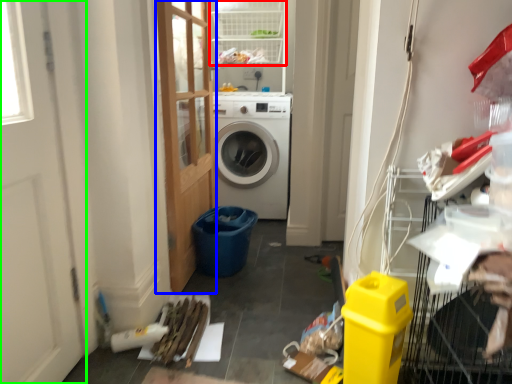
Question: Which object is positioned closest to shelf (highlighted by a red box)? Select from door (highlighted by a blue box) and screen door (highlighted by a green box).

Choices:
 (A) door
 (B) screen door

Answer: (A)